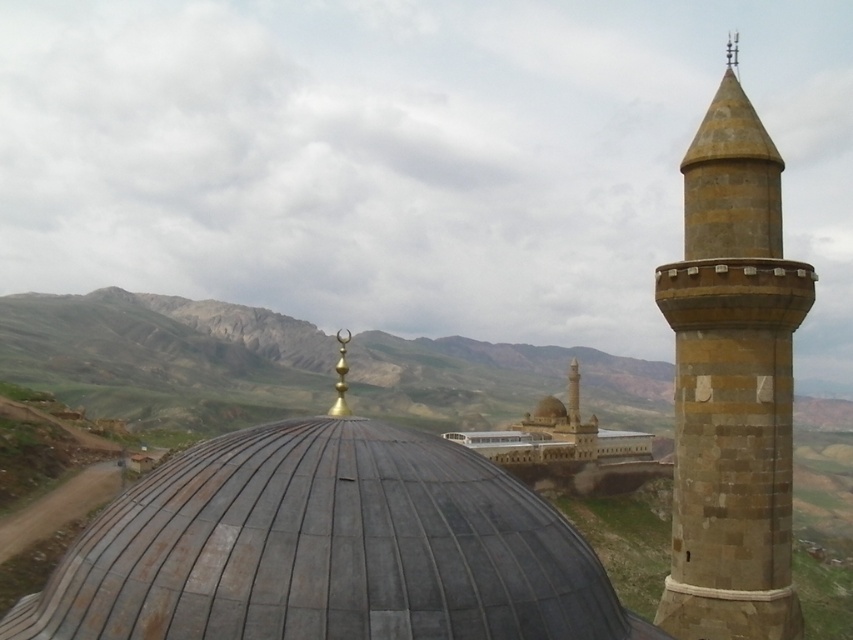
Which is below, gray tiled dome at center or brown stone tower at right?

Positioned lower is gray tiled dome at center.

Which is in front, point (544, 576) or point (773, 224)?

Positioned in front is point (544, 576).

Find the location of a particular element. The height and width of the screenshot is (640, 853). gray tiled dome at center is located at coordinates (328, 547).